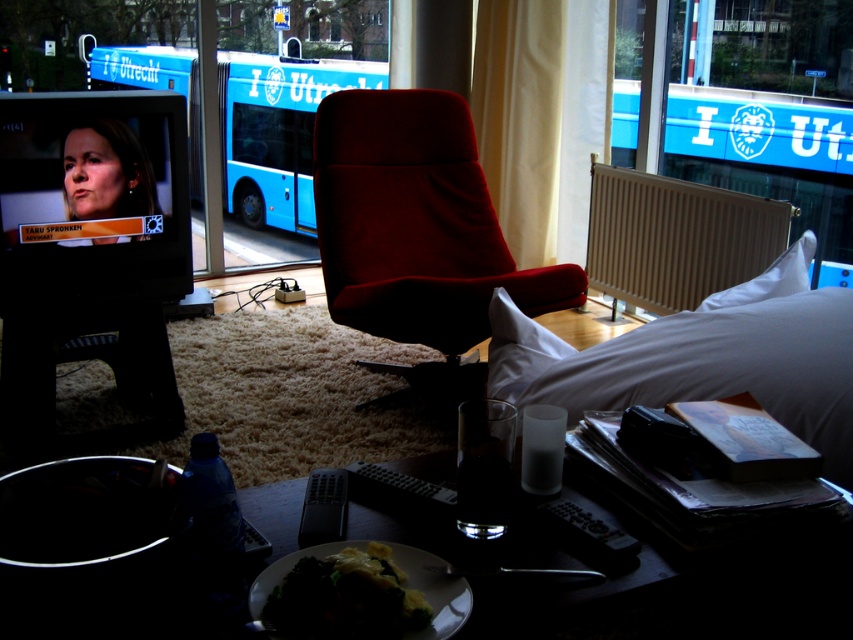
Can you confirm if white matte bed at lower right is positioned to the left of beige metallic radiator at right?

Indeed, white matte bed at lower right is positioned on the left side of beige metallic radiator at right.

Does point (769, 406) come in front of point (633, 236)?

Yes, it is in front of point (633, 236).

You are a GUI agent. You are given a task and a screenshot of the screen. Output one action in this format:
    pyautogui.click(x=<x>, y=<y>)
    Task: Click on the white matte bed at lower right
    This screenshot has height=640, width=853.
    Given the screenshot: What is the action you would take?
    pyautogui.click(x=695, y=364)

Based on the photo, is white matte bed at lower right taller than white soft pillow at upper right?

Correct, white matte bed at lower right is much taller as white soft pillow at upper right.

Is white matte bed at lower right behind white soft pillow at upper right?

That is False.

Is point (650, 384) positioned in front of point (799, 266)?

Yes, point (650, 384) is in front of point (799, 266).

At what (x,y) coordinates should I click in order to perform the action: click on white matte bed at lower right. Please return your answer as a coordinate pair (x, y). The width and height of the screenshot is (853, 640). Looking at the image, I should click on (695, 364).

At what (x,y) coordinates should I click in order to perform the action: click on velvet red armchair at center. Please return your answer as a coordinate pair (x, y). Looking at the image, I should click on (416, 234).

Is velvet red armchair at center positioned at the back of white soft pillow at upper right?

Yes.

What do you see at coordinates (416, 234) in the screenshot? The height and width of the screenshot is (640, 853). I see `velvet red armchair at center` at bounding box center [416, 234].

Identify the location of velvet red armchair at center. (416, 234).